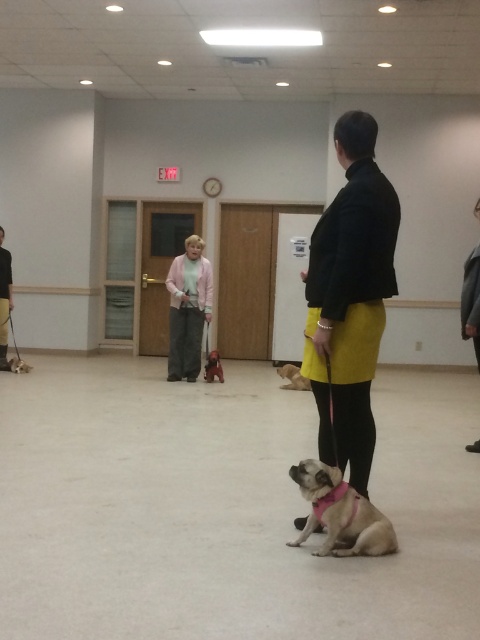
Between black matte skirt at center and pink fabric jacket at center, which one has more height?

With more height is black matte skirt at center.

Is black matte skirt at center thinner than pink fabric jacket at center?

Yes, black matte skirt at center is thinner than pink fabric jacket at center.

Is point (335, 394) less distant than point (168, 323)?

That is True.

Where is `black matte skirt at center`? black matte skirt at center is located at coordinates (349, 296).

Between pink fabric jacket at center and shiny black dog at center, which one appears on the right side from the viewer's perspective?

Positioned to the right is shiny black dog at center.

In the scene shown: Is pink fabric jacket at center wider than shiny black dog at center?

Indeed, pink fabric jacket at center has a greater width compared to shiny black dog at center.

Is point (181, 262) positioned before point (218, 371)?

Yes.

Where is `pink fabric jacket at center`? pink fabric jacket at center is located at coordinates (188, 308).

Is the position of black matte skirt at center less distant than that of fuzzy beige dog at center?

Yes, it is in front of fuzzy beige dog at center.

Describe the element at coordinates (349, 296) in the screenshot. The image size is (480, 640). I see `black matte skirt at center` at that location.

Between point (305, 358) and point (294, 371), which one is positioned in front?

Point (305, 358) is more forward.

I want to click on black matte skirt at center, so click(x=349, y=296).